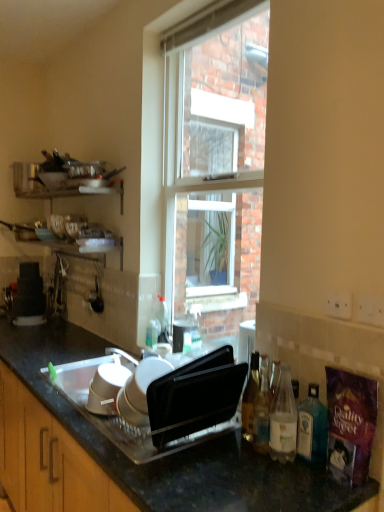
Where is `vacant space in front of translucent glass bottle at right, which ranks as the 1th bottle in right-to-left order`? This screenshot has width=384, height=512. vacant space in front of translucent glass bottle at right, which ranks as the 1th bottle in right-to-left order is located at coordinates (308, 483).